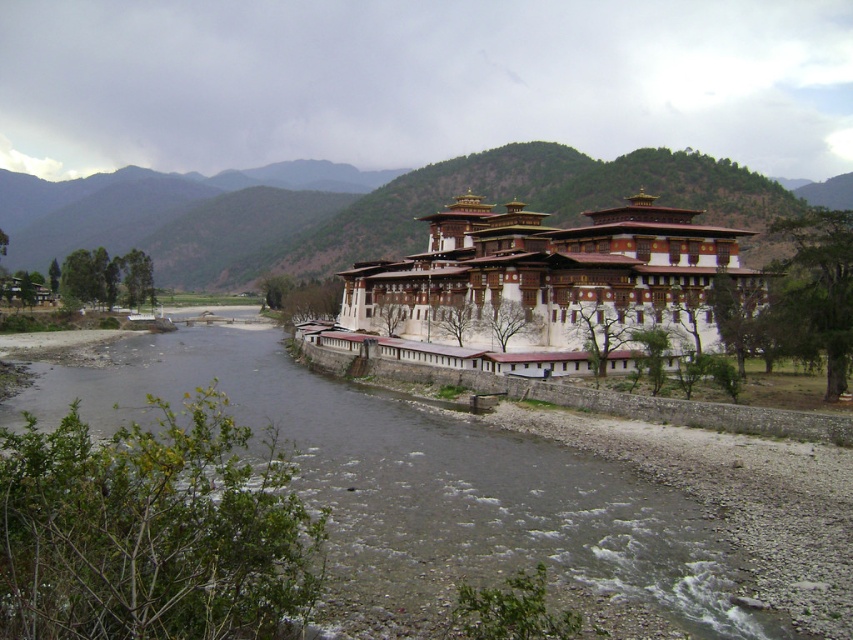
You are standing at the point marked by the coordinates point (354,209) in the image. Based on the scene described, what type of terrain are you currently standing on?

The point (354,209) is on green forested mountain at center, so you are standing on a green forested mountain.

Based on the photo, you are standing on the palace grounds and want to cross the brown gravel stream at lower center to reach the green forested mountain at center. Can you walk directly from the palace to the mountain without crossing the stream?

The brown gravel stream at lower center is shorter than the green forested mountain at center, so you cannot walk directly from the palace to the mountain without crossing the stream because the stream is in between them.

You are standing at the riverbank near the palace. Where is the green forested mountain at center located in relation to your position?

The green forested mountain at center is located at point coordinates of 0.327 on the x axis and 0.416 on the y axis.